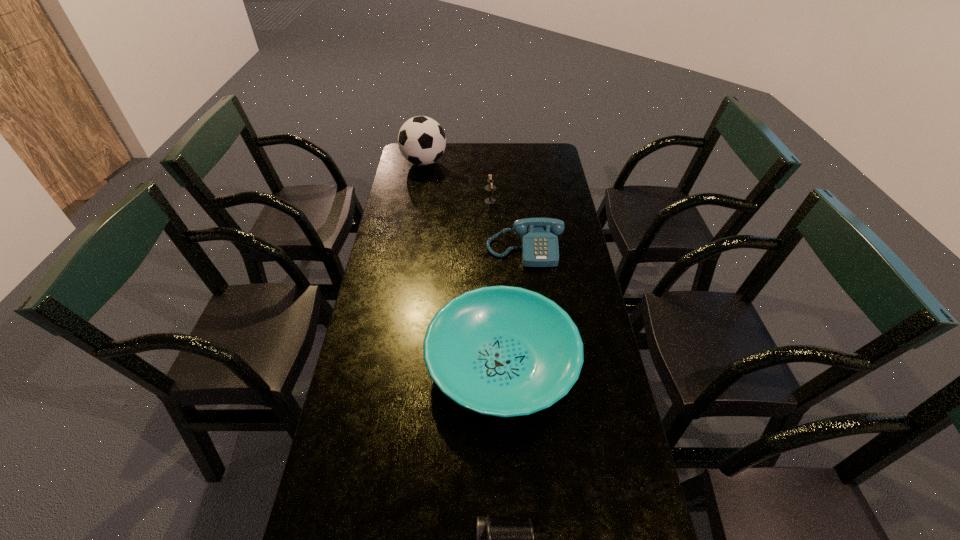
This screenshot has width=960, height=540. Identify the location of the tallest object. (421, 140).

The image size is (960, 540). I want to click on soccer ball, so click(421, 140).

You are a GUI agent. You are given a task and a screenshot of the screen. Output one action in this format:
    pyautogui.click(x=<x>, y=<y>)
    Task: Click on the candle holder
    The image size is (960, 540).
    Given the screenshot: What is the action you would take?
    pyautogui.click(x=490, y=187)

Find the location of a particular element. The height and width of the screenshot is (540, 960). the second farthest object is located at coordinates (490, 187).

Locate an element on the screen. The image size is (960, 540). the third nearest object is located at coordinates (539, 244).

Where is `dish`? Image resolution: width=960 pixels, height=540 pixels. dish is located at coordinates (505, 351).

The width and height of the screenshot is (960, 540). Identify the location of vacant area located on the right of the farthest object. (511, 163).

Where is `free space located on the left of the candle holder`? This screenshot has height=540, width=960. free space located on the left of the candle holder is located at coordinates (436, 201).

Image resolution: width=960 pixels, height=540 pixels. What are the coordinates of `vacant space located on the dial of the third nearest object` in the screenshot? It's located at (531, 312).

Find the location of a particular element. vacant position located 0.370m on the back of the dish is located at coordinates (496, 233).